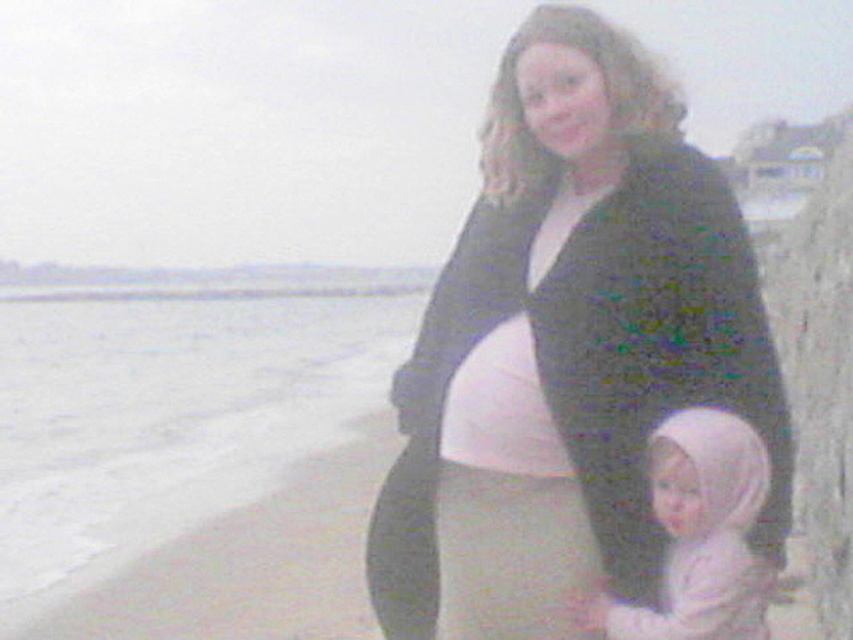
Question: Among these points, which one is farthest from the camera?

Choices:
 (A) (514, 140)
 (B) (480, 396)
 (C) (682, 518)

Answer: (A)

Question: Is pink fabric baby at lower center below matte white belly at center?

Choices:
 (A) no
 (B) yes

Answer: (B)

Question: Based on their relative distances, which object is nearer to the matte white belly at center?

Choices:
 (A) pink fabric baby at lower center
 (B) matte black sweater at center

Answer: (B)

Question: Which object is farther from the camera taking this photo?

Choices:
 (A) matte white belly at center
 (B) pink fabric baby at lower center
 (C) matte black sweater at center

Answer: (A)

Question: Is matte black sweater at center above pink fabric baby at lower center?

Choices:
 (A) yes
 (B) no

Answer: (A)

Question: From the image, what is the correct spatial relationship of pink fabric baby at lower center in relation to matte white belly at center?

Choices:
 (A) above
 (B) below

Answer: (B)